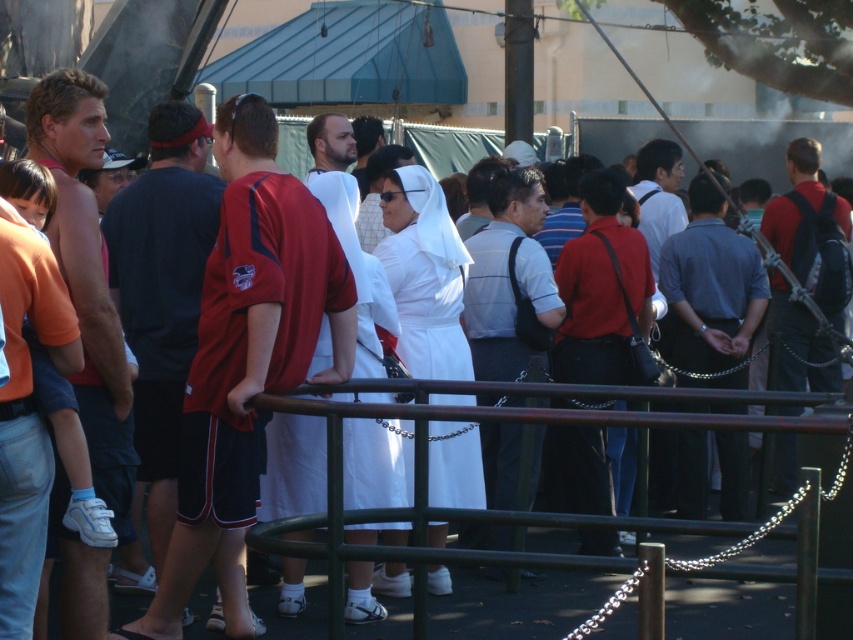
Question: Where is dark blue jersey at center located in relation to matte black backpack at right in the image?

Choices:
 (A) above
 (B) below

Answer: (B)

Question: Based on their relative distances, which object is farther from the red fabric shirt at center?

Choices:
 (A) dark blue jersey at center
 (B) matte skin man at left
 (C) dark gray shirt at center

Answer: (C)

Question: Which object is the closest to the matte black backpack at right?

Choices:
 (A) green metal railing at center
 (B) matte skin man at left
 (C) red fabric shirt at center
 (D) dark blue jersey at center

Answer: (D)

Question: Can you confirm if green metal railing at center is wider than bearded man at center?

Choices:
 (A) no
 (B) yes

Answer: (B)

Question: Is matte skin man at left positioned behind matte black backpack at right?

Choices:
 (A) no
 (B) yes

Answer: (A)

Question: Among these points, which one is nearest to the camera?

Choices:
 (A) (36, 112)
 (B) (154, 294)
 (C) (809, 257)

Answer: (A)